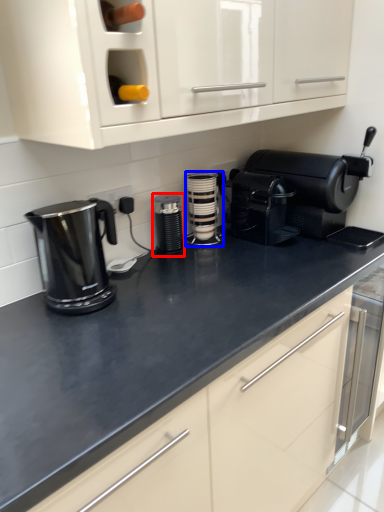
Question: Which object is further to the camera taking this photo, kitchen appliance (highlighted by a red box) or kitchen appliance (highlighted by a blue box)?

Choices:
 (A) kitchen appliance
 (B) kitchen appliance

Answer: (B)